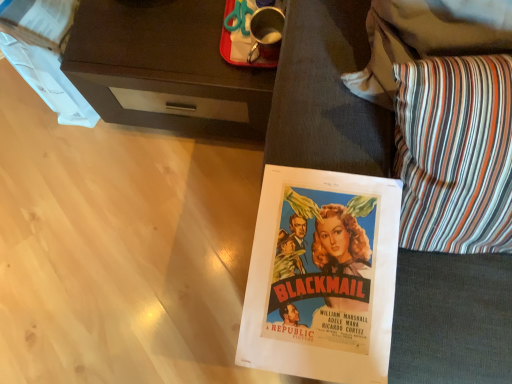
Question: Is point (420, 200) closer or farther from the camera than point (71, 71)?

Choices:
 (A) farther
 (B) closer

Answer: (B)

Question: From the image's perspective, is striped fabric pillow at lower right above or below dark wood desk at upper left?

Choices:
 (A) above
 (B) below

Answer: (B)

Question: From a real-world perspective, relative to dark wood desk at upper left, is striped fabric pillow at lower right vertically above or below?

Choices:
 (A) below
 (B) above

Answer: (B)

Question: Does point (117, 1) appear closer or farther from the camera than point (464, 152)?

Choices:
 (A) farther
 (B) closer

Answer: (A)

Question: Based on their sizes in the image, would you say dark wood desk at upper left is bigger or smaller than striped fabric pillow at lower right?

Choices:
 (A) big
 (B) small

Answer: (A)

Question: From their relative heights in the image, would you say dark wood desk at upper left is taller or shorter than striped fabric pillow at lower right?

Choices:
 (A) tall
 (B) short

Answer: (A)

Question: From the image's perspective, is dark wood desk at upper left positioned above or below striped fabric pillow at lower right?

Choices:
 (A) above
 (B) below

Answer: (A)